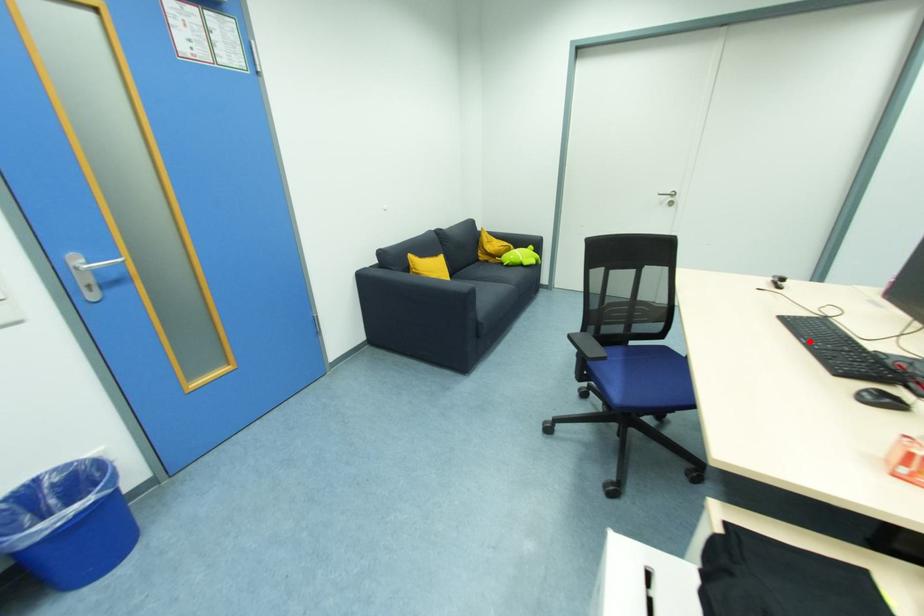
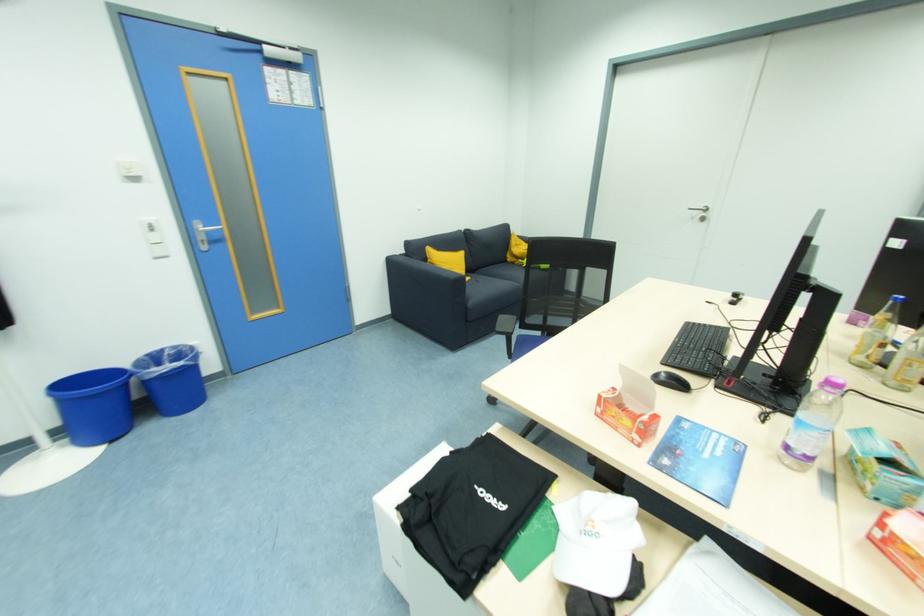
Locate, in the second image, the point that corresponds to the highlighted location in the first image.

(684, 342)